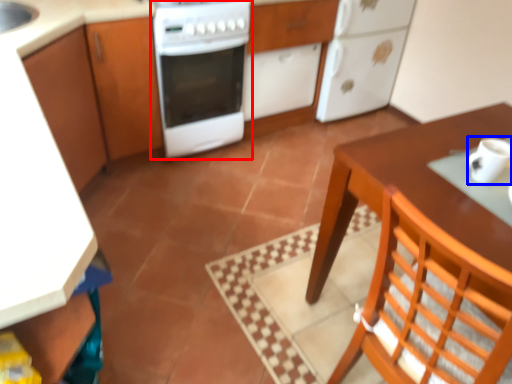
Question: Among these objects, which one is farthest to the camera, home appliance (highlighted by a red box) or mug (highlighted by a blue box)?

Choices:
 (A) home appliance
 (B) mug

Answer: (A)